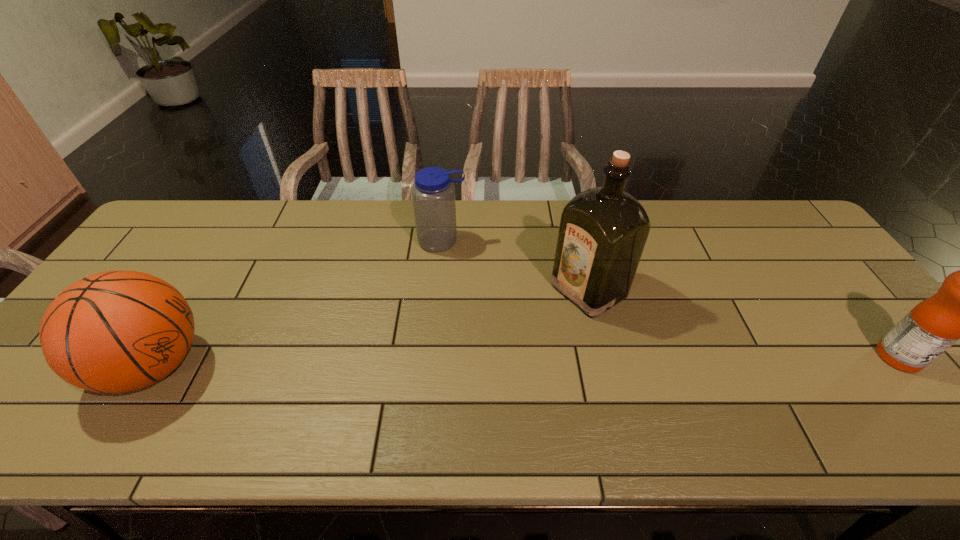
The height and width of the screenshot is (540, 960). I want to click on vacant space located on the label of the second object from right to left, so click(539, 321).

Where is `free space located on the label of the second object from right to left`? free space located on the label of the second object from right to left is located at coordinates (524, 330).

Locate an element on the screen. This screenshot has width=960, height=540. vacant position located 0.370m on the label of the second object from right to left is located at coordinates (444, 378).

The width and height of the screenshot is (960, 540). In order to click on object present at the far edge in this screenshot , I will do `click(433, 193)`.

Find the location of a particular element. basketball that is at the near edge is located at coordinates (118, 331).

Find the location of a particular element. Image resolution: width=960 pixels, height=540 pixels. fruit juice positioned at the near edge is located at coordinates (959, 310).

In order to click on object at the left edge in this screenshot , I will do `click(118, 331)`.

This screenshot has width=960, height=540. What are the coordinates of `object situated at the right edge` in the screenshot? It's located at (959, 310).

I want to click on object located at the near left corner, so click(118, 331).

This screenshot has height=540, width=960. I want to click on object positioned at the near right corner, so click(959, 310).